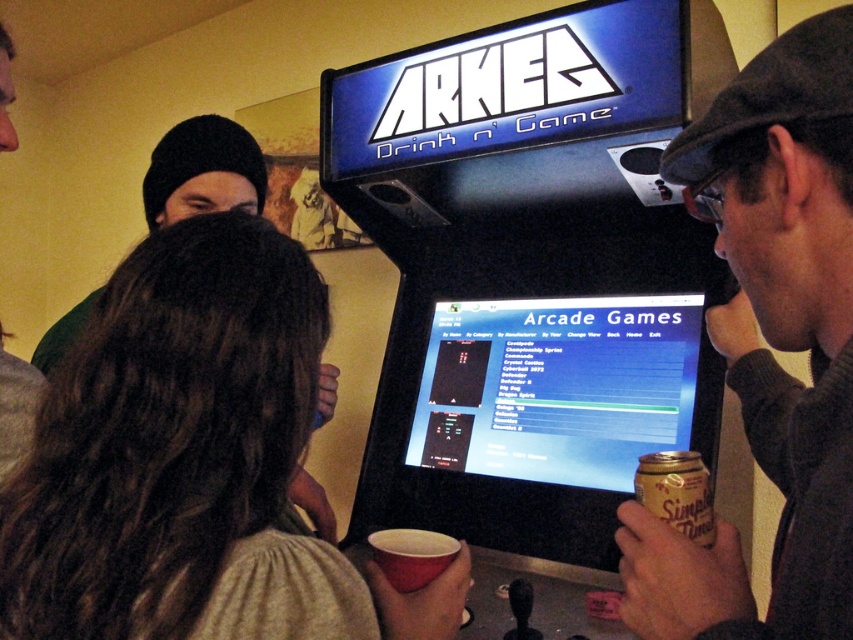
Question: Which of the following is the farthest from the observer?

Choices:
 (A) matte red cup at lower center
 (B) shiny plastic screen at center
 (C) smooth beige sweater at center

Answer: (B)

Question: Which object is the closest to the matte red cup at lower center?

Choices:
 (A) dark gray wool cap at upper right
 (B) smooth beige sweater at center
 (C) shiny plastic screen at center

Answer: (B)

Question: Does shiny plastic screen at center lie behind gold foil can at lower right?

Choices:
 (A) no
 (B) yes

Answer: (B)

Question: Can you confirm if smooth beige sweater at center is wider than matte red cup at lower center?

Choices:
 (A) no
 (B) yes

Answer: (B)

Question: Which point is farther to the camera?

Choices:
 (A) gold foil can at lower right
 (B) shiny plastic screen at center

Answer: (B)

Question: Is dark gray wool cap at upper right positioned behind gold foil can at lower right?

Choices:
 (A) yes
 (B) no

Answer: (B)